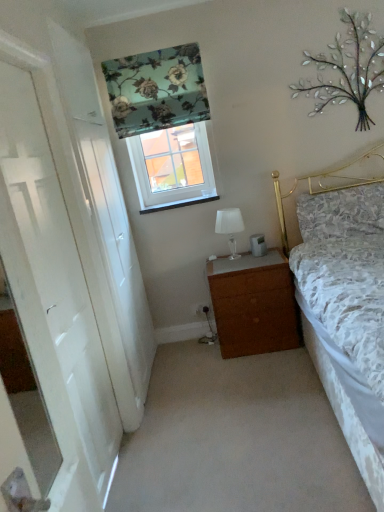
At what (x,y) coordinates should I click in order to perform the action: click on empty space that is ontop of brown wood chest of drawers at center. Please return your answer as a coordinate pair (x, y). The width and height of the screenshot is (384, 512). Looking at the image, I should click on (232, 254).